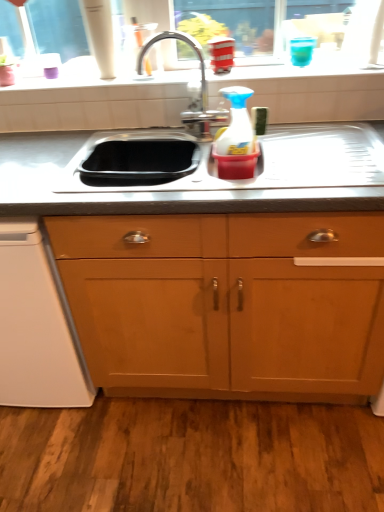
Image resolution: width=384 pixels, height=512 pixels. I want to click on vacant space situated above white glossy window sill at upper center (from a real-world perspective), so click(x=186, y=73).